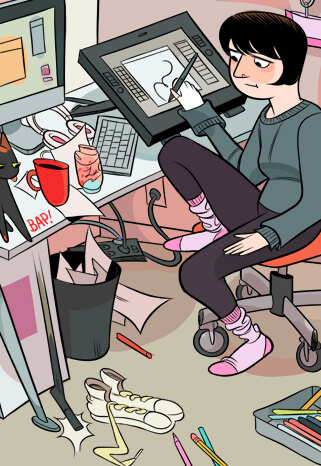
I want to click on keyboard, so click(117, 140).